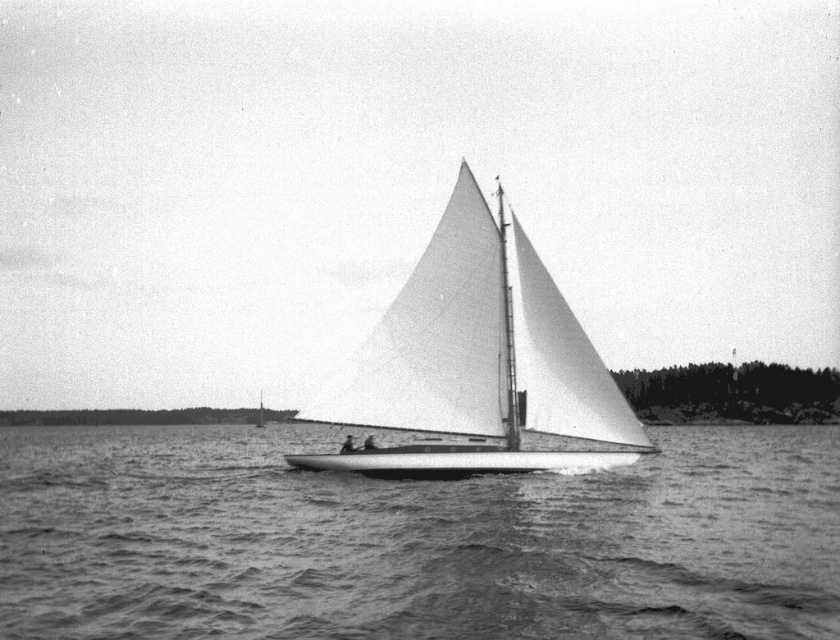
You are a photographer trying to capture the white matte sailboat at center and the smooth water at center in a single shot. Since you want the sailboat to be the main focus, should you position the sailboat on the left or right side of the frame?

The smooth water at center is positioned on the left side of white matte sailboat at center, so to make the sailboat the main focus, you should position it on the right side of the frame so the water is on the left.

You are a photographer trying to capture the white matte sailboat at center and the smooth water at center in a single shot. Based on their relative sizes, which object should appear larger in the photo?

The white matte sailboat at center should appear larger in the photo because it is taller than the smooth water at center.